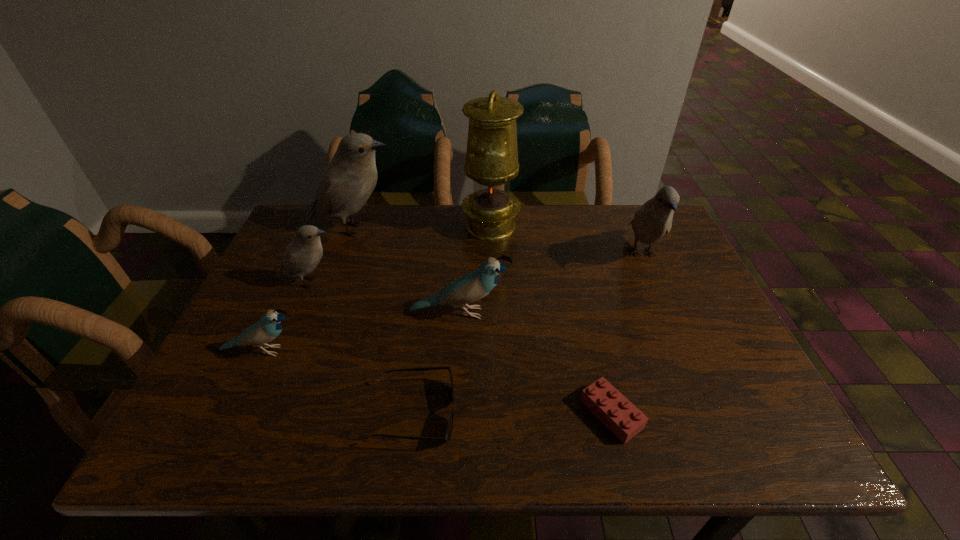
Where is `vacant space that satisfies the following two spatial constraints: 1. on the back side of the pink Lego; 2. at the face of the fourth nearest object`? vacant space that satisfies the following two spatial constraints: 1. on the back side of the pink Lego; 2. at the face of the fourth nearest object is located at coordinates (587, 313).

Identify the location of free space that satisfies the following two spatial constraints: 1. at the beak of the rightmost white bird; 2. at the face of the nearer blue bird. (684, 351).

Locate an element on the screen. vacant space that satisfies the following two spatial constraints: 1. on the front side of the oil lamp; 2. on the left side of the pink Lego is located at coordinates (496, 414).